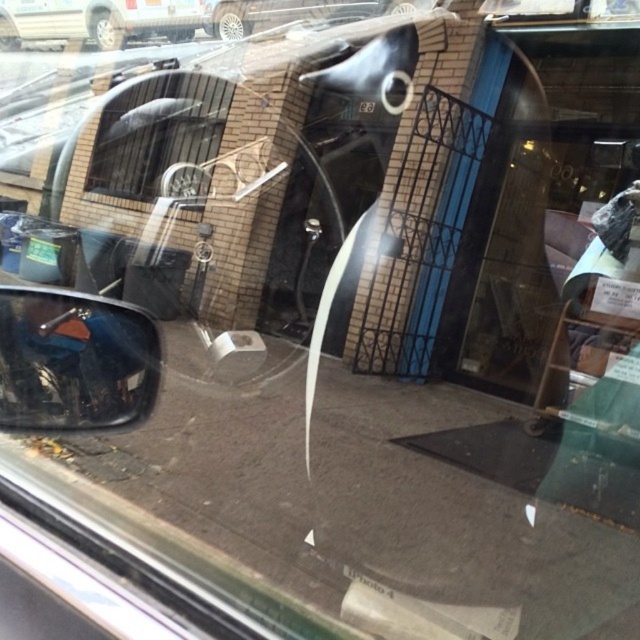
Question: Can you confirm if clear glass window at upper left is positioned to the right of metallic silver van at upper left?

Choices:
 (A) yes
 (B) no

Answer: (A)

Question: Which of these objects is positioned farthest from the clear glass window at upper left?

Choices:
 (A) matte black view mirror at left
 (B) metallic silver van at upper left

Answer: (A)

Question: Which object is the farthest from the clear glass window at upper left?

Choices:
 (A) metallic silver van at upper left
 (B) matte black view mirror at left

Answer: (B)

Question: In this image, where is matte black view mirror at left located relative to clear glass window at upper left?

Choices:
 (A) below
 (B) above

Answer: (A)

Question: From the image, what is the correct spatial relationship of clear glass window at upper left in relation to metallic silver van at upper left?

Choices:
 (A) below
 (B) above

Answer: (A)

Question: Which object is positioned closest to the clear glass window at upper left?

Choices:
 (A) metallic silver van at upper left
 (B) matte black view mirror at left

Answer: (A)